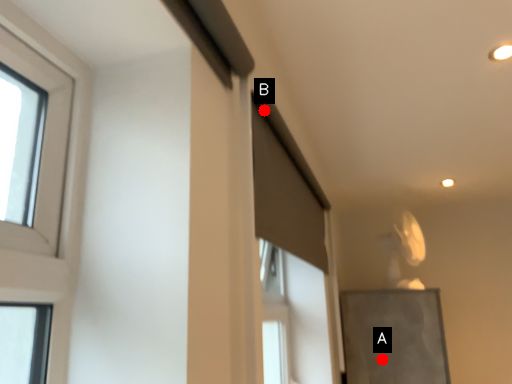
Question: Two points are circled on the image, labeled by A and B beside each circle. Which point is farther from the camera taking this photo?

Choices:
 (A) A is further
 (B) B is further

Answer: (A)